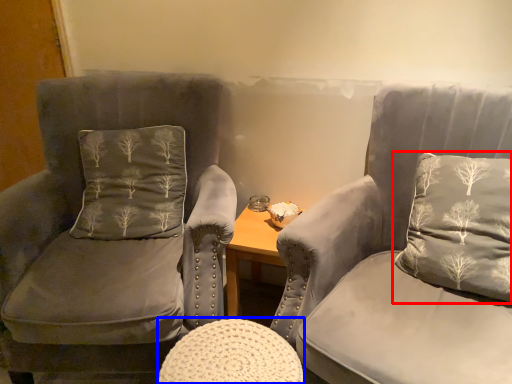
Question: Which object appears farthest to the camera in this image, pillow (highlighted by a red box) or stool (highlighted by a blue box)?

Choices:
 (A) pillow
 (B) stool

Answer: (A)